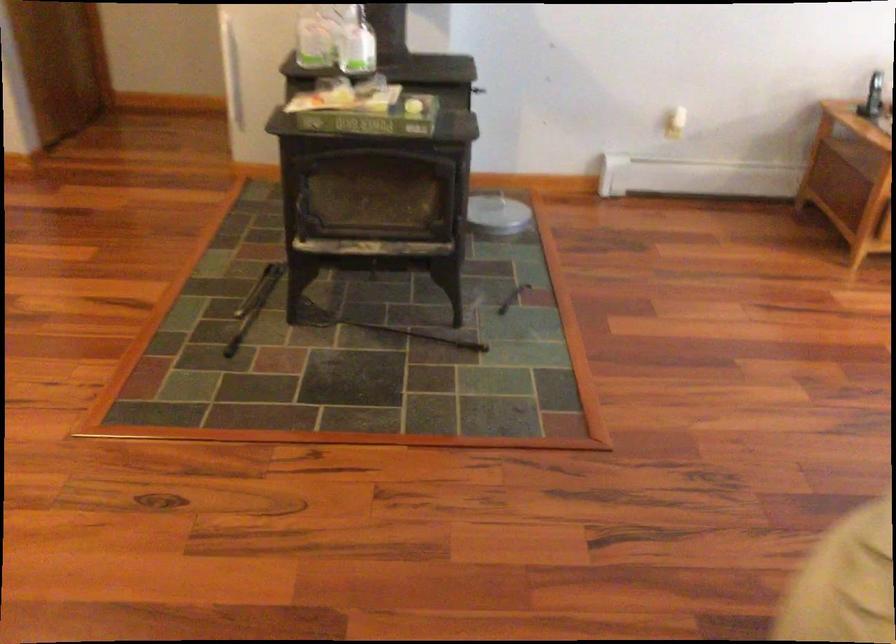
Where would you lift the metal lid handle? Please return your answer as a coordinate pair (x, y).

(477, 90)